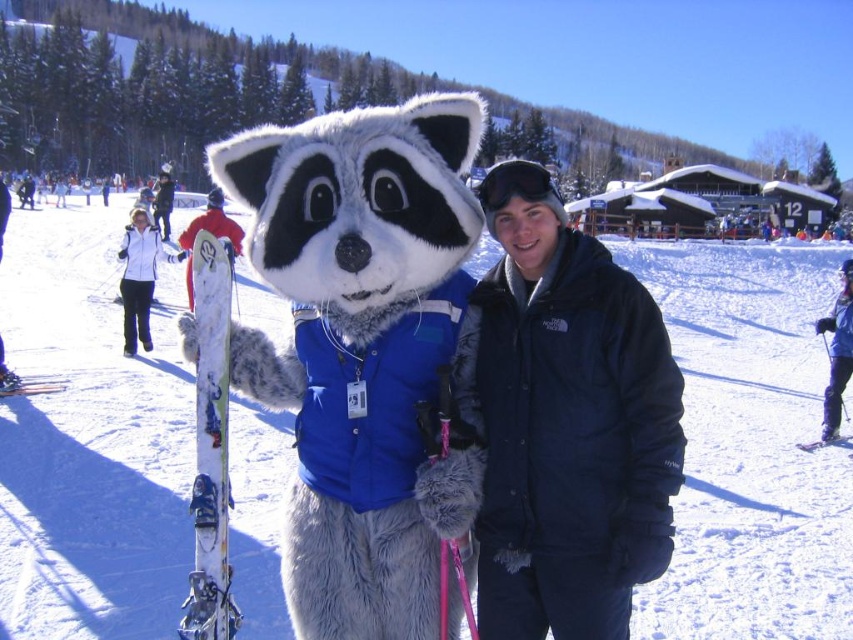
You are standing at the entrance of the ski resort and want to locate the mascot. According to the coordinates provided, where should you look to find the white fluffy mascot at center?

The white fluffy mascot at center is located at coordinates point (90, 438).